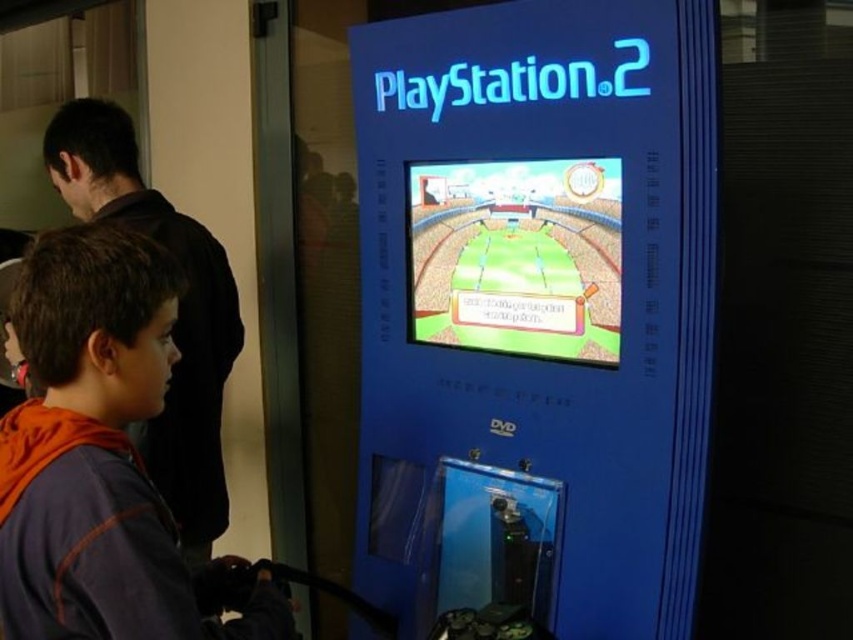
Question: Can you confirm if cartoonish plastic soccer field at center is wider than dark brown hoodie at left?

Choices:
 (A) no
 (B) yes

Answer: (A)

Question: Is blue plastic playstation 2 at center above dark brown hoodie at left?

Choices:
 (A) no
 (B) yes

Answer: (A)

Question: Is blue plastic playstation 2 at center bigger than dark brown hoodie at left?

Choices:
 (A) yes
 (B) no

Answer: (A)

Question: Which point is closer to the camera?

Choices:
 (A) (77, 536)
 (B) (508, 321)
 (C) (201, 468)

Answer: (A)

Question: Which object appears closest to the camera in this image?

Choices:
 (A) cartoonish plastic soccer field at center
 (B) blue plastic playstation 2 at center
 (C) dark brown hoodie at left
 (D) orange fleece jacket at lower left

Answer: (D)

Question: Which of the following is the closest to the observer?

Choices:
 (A) (578, 250)
 (B) (451, 109)
 (C) (206, 538)
 (D) (39, 572)

Answer: (D)